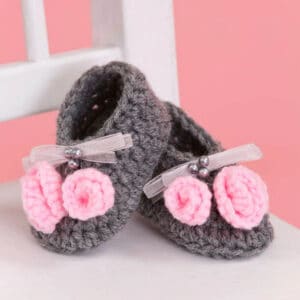
Where is `decorative silver balls`? decorative silver balls is located at coordinates (203, 173).